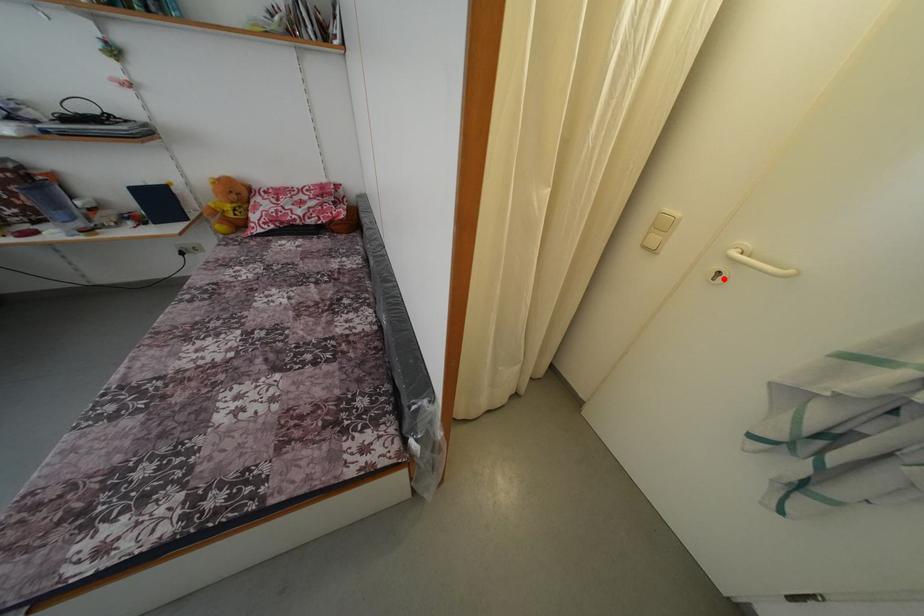
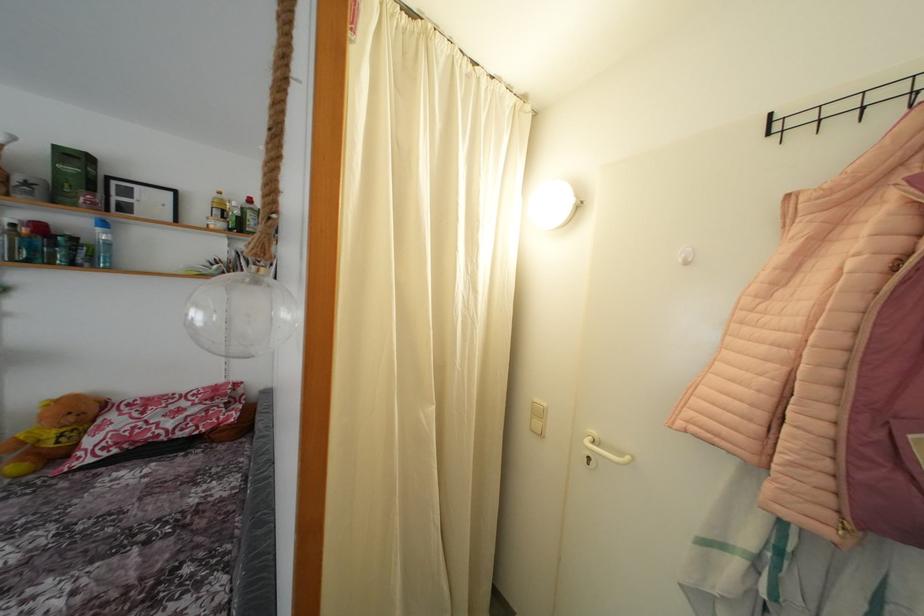
Locate, in the second image, the point that corresponds to the highlighted location in the first image.

(593, 464)